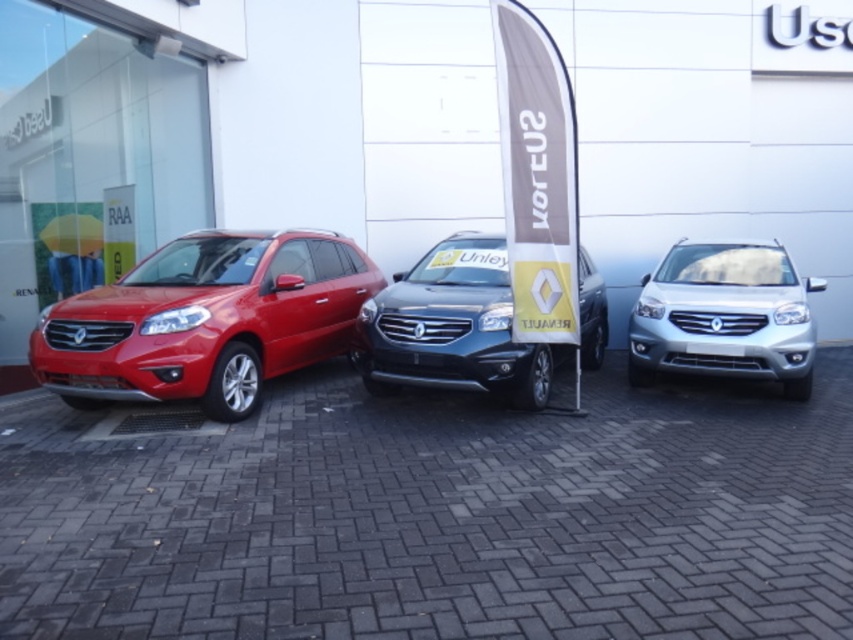
You are a customer at the dealership and want to know which SUV is larger between the matte red suv at left and the satin metallic suv at center. Which one is bigger?

The matte red suv at left is bigger than the satin metallic suv at center according to the description provided.

Based on the photo, you are standing in front of the dealership building and see the matte red suv at left. Where exactly is it positioned relative to the dealership building?

The matte red suv at left is positioned at point [206,320] relative to the dealership building.